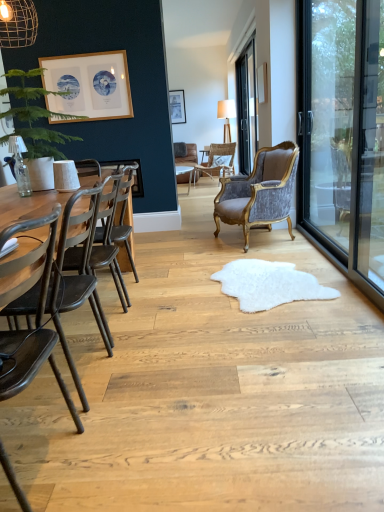
Question: Can you confirm if wooden picture frame at upper right, placed as the second picture frame when sorted from top to bottom, is bigger than wooden textured lamp at center, which is the second lamp in bottom-to-top order?

Choices:
 (A) no
 (B) yes

Answer: (A)

Question: Is wooden picture frame at upper right, which ranks as the 3th picture frame in left-to-right order, taller than wooden textured lamp at center, which is the second lamp in bottom-to-top order?

Choices:
 (A) yes
 (B) no

Answer: (B)

Question: From a real-world perspective, is wooden picture frame at upper right, which ranks as the 3th picture frame in left-to-right order, physically above wooden textured lamp at center, which is the second lamp in bottom-to-top order?

Choices:
 (A) no
 (B) yes

Answer: (B)

Question: From the image's perspective, does wooden picture frame at upper right, the second picture frame positioned from the back, appear higher than wooden textured lamp at center, the first lamp positioned from the back?

Choices:
 (A) yes
 (B) no

Answer: (B)

Question: From the image's perspective, does wooden picture frame at upper right, which is the first picture frame from right to left, appear lower than wooden textured lamp at center, which is the second lamp in bottom-to-top order?

Choices:
 (A) yes
 (B) no

Answer: (A)

Question: Do you think transparent glass door at center right is within green matte plant at left, or outside of it?

Choices:
 (A) inside
 (B) outside

Answer: (B)

Question: In the image, is transparent glass door at center right on the left side or the right side of green matte plant at left?

Choices:
 (A) left
 (B) right

Answer: (B)

Question: Is point (253, 57) closer or farther from the camera than point (36, 74)?

Choices:
 (A) closer
 (B) farther

Answer: (B)

Question: Considering their positions, is transparent glass door at center right located in front of or behind green matte plant at left?

Choices:
 (A) behind
 (B) front

Answer: (A)

Question: From the image's perspective, relative to transparent glass door at center right, is dark brown leather swivel chair at left above or below?

Choices:
 (A) above
 (B) below

Answer: (B)

Question: In the image, is dark brown leather swivel chair at left positioned in front of or behind transparent glass door at center right?

Choices:
 (A) front
 (B) behind

Answer: (A)

Question: From a real-world perspective, is dark brown leather swivel chair at left above or below transparent glass door at center right?

Choices:
 (A) below
 (B) above

Answer: (A)

Question: Is dark brown leather swivel chair at left wider or thinner than transparent glass door at center right?

Choices:
 (A) wide
 (B) thin

Answer: (A)

Question: From a real-world perspective, is white fluffy rug at center above or below matte wooden picture frame at center, the second picture frame from the right?

Choices:
 (A) above
 (B) below

Answer: (B)

Question: Considering the positions of point (301, 286) and point (170, 98), is point (301, 286) closer or farther from the camera than point (170, 98)?

Choices:
 (A) farther
 (B) closer

Answer: (B)